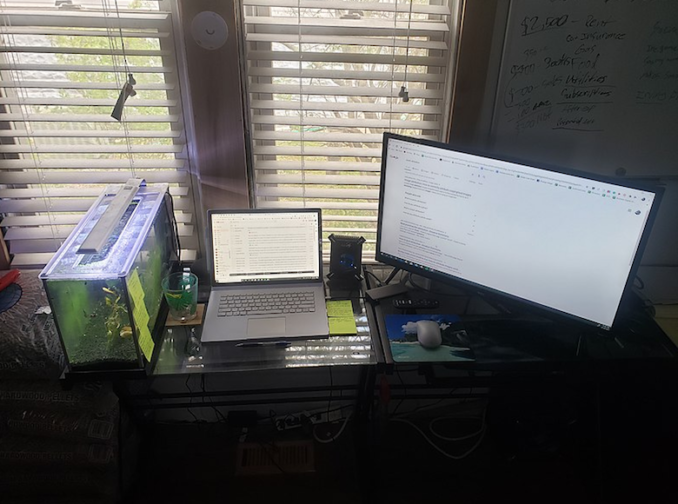
Where is `computer keyboard`? Image resolution: width=678 pixels, height=504 pixels. computer keyboard is located at coordinates (259, 306).